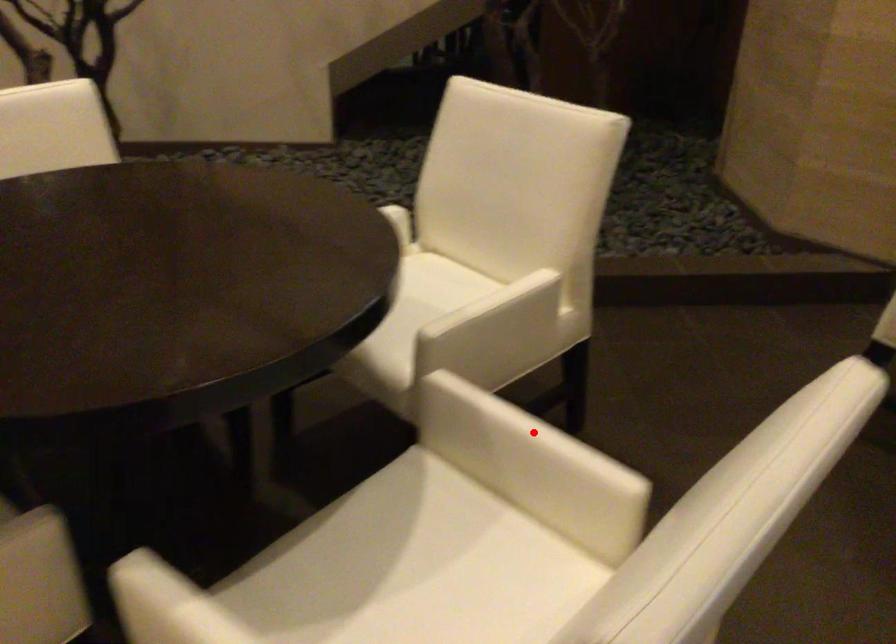
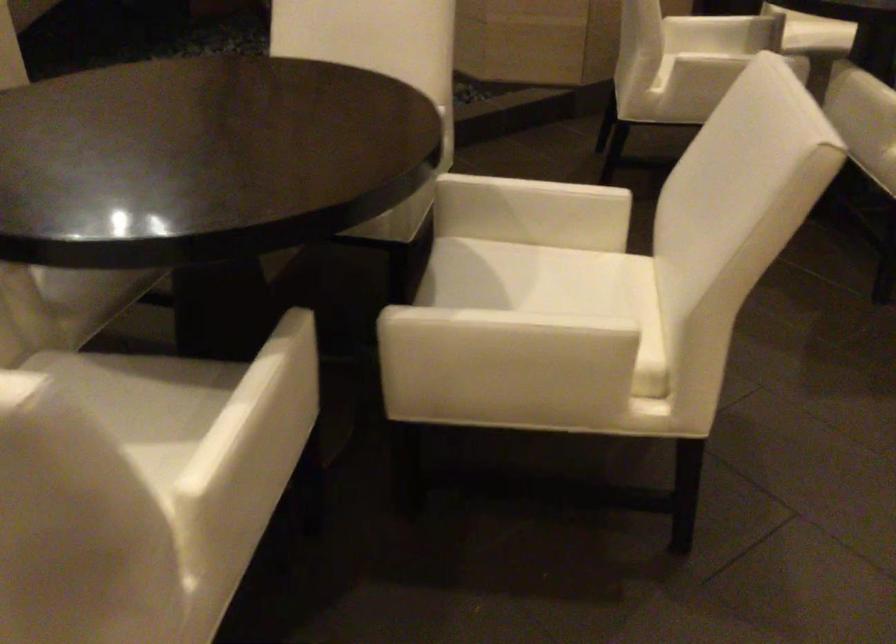
Question: I am providing you with two images of the same scene from different viewpoints. Given a red point in image1, look at the same physical point in image2. Is it:

Choices:
 (A) Closer to the viewpoint
 (B) Farther from the viewpoint

Answer: (B)